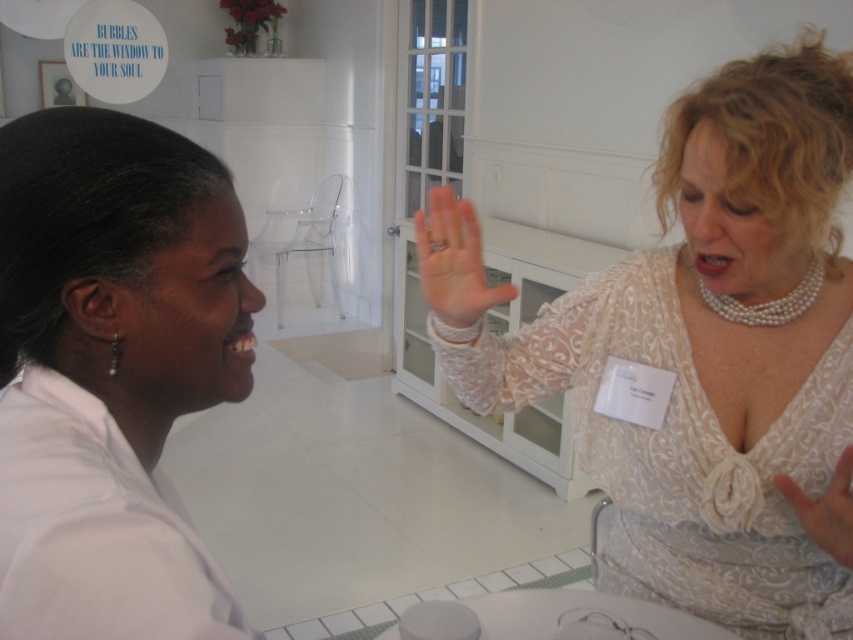
Describe the element at coordinates (695, 349) in the screenshot. I see `white lace dress at upper right` at that location.

Can you confirm if white lace dress at upper right is positioned below pearl earring at left?

Yes.

I want to click on white lace dress at upper right, so click(x=695, y=349).

Does white lace dress at upper right appear over pink flesh-toned hand at center?

Actually, white lace dress at upper right is below pink flesh-toned hand at center.

Between white lace dress at upper right and pink flesh-toned hand at center, which one is positioned lower?

white lace dress at upper right is lower down.

Does point (808, 456) lie behind point (456, 202)?

Yes, it is.

Image resolution: width=853 pixels, height=640 pixels. Identify the location of white lace dress at upper right. (695, 349).

Which of these two, white matte lab coat at left or pink flesh-toned hand at center, stands taller?

Standing taller between the two is white matte lab coat at left.

Can you confirm if white matte lab coat at left is smaller than pink flesh-toned hand at center?

Actually, white matte lab coat at left might be larger than pink flesh-toned hand at center.

Image resolution: width=853 pixels, height=640 pixels. In order to click on white matte lab coat at left in this screenshot , I will do `click(107, 371)`.